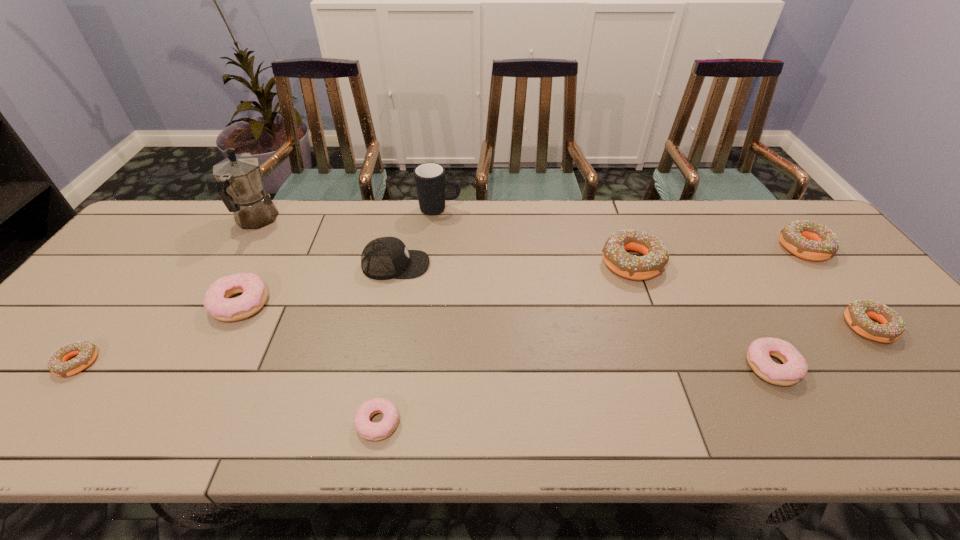
At what (x,y) coordinates should I click in order to perform the action: click on free space located 0.070m on the front of the second nearest chocolate doughnut. Please return your answer as a coordinate pair (x, y). This screenshot has width=960, height=540. Looking at the image, I should click on (906, 372).

This screenshot has height=540, width=960. Identify the location of vacant region located 0.320m on the back of the fifth doughnut from left to right. (709, 256).

Locate an element on the screen. vacant region located on the right of the leftmost object is located at coordinates (271, 363).

What are the coordinates of `vacant space situated 0.140m on the left of the nearest object` in the screenshot? It's located at 288,423.

Where is `coffeepot at the far edge`? The image size is (960, 540). coffeepot at the far edge is located at coordinates (240, 186).

Locate an element on the screen. The height and width of the screenshot is (540, 960). mug that is at the far edge is located at coordinates (430, 180).

Find the location of a particular element. object located in the near edge section of the desktop is located at coordinates (368, 430).

At what (x,y) coordinates should I click in order to perform the action: click on object positioned at the left edge. Please return your answer as a coordinate pair (x, y). Image resolution: width=960 pixels, height=540 pixels. Looking at the image, I should click on (86, 352).

Locate an element on the screen. The image size is (960, 540). object situated at the far right corner is located at coordinates (808, 240).

Where is `vacant region at the far edge of the desktop`? This screenshot has height=540, width=960. vacant region at the far edge of the desktop is located at coordinates (532, 239).